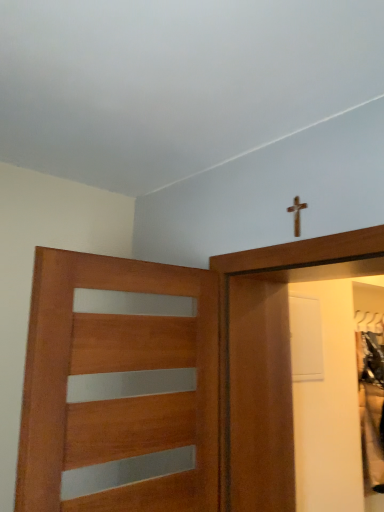
Question: From the image's perspective, would you say wooden cross at upper center is shown under wooden door with frosted glass panels at left?

Choices:
 (A) yes
 (B) no

Answer: (B)

Question: Can you confirm if wooden cross at upper center is positioned to the left of wooden door with frosted glass panels at left?

Choices:
 (A) no
 (B) yes

Answer: (A)

Question: Does wooden cross at upper center have a larger size compared to wooden door with frosted glass panels at left?

Choices:
 (A) yes
 (B) no

Answer: (B)

Question: Is wooden cross at upper center positioned in front of wooden door with frosted glass panels at left?

Choices:
 (A) no
 (B) yes

Answer: (A)

Question: Is wooden cross at upper center smaller than wooden door with frosted glass panels at left?

Choices:
 (A) yes
 (B) no

Answer: (A)

Question: Is wooden cross at upper center beside wooden door with frosted glass panels at left?

Choices:
 (A) no
 (B) yes

Answer: (A)

Question: From a real-world perspective, is wooden door with frosted glass panels at left over wooden cross at upper center?

Choices:
 (A) yes
 (B) no

Answer: (B)

Question: Is the depth of wooden door with frosted glass panels at left greater than that of wooden cross at upper center?

Choices:
 (A) yes
 (B) no

Answer: (B)

Question: Would you say wooden door with frosted glass panels at left is outside wooden cross at upper center?

Choices:
 (A) no
 (B) yes

Answer: (B)

Question: From the image's perspective, is wooden door with frosted glass panels at left located beneath wooden cross at upper center?

Choices:
 (A) yes
 (B) no

Answer: (A)

Question: Is wooden door with frosted glass panels at left facing away from wooden cross at upper center?

Choices:
 (A) yes
 (B) no

Answer: (B)

Question: Considering the relative sizes of wooden door with frosted glass panels at left and wooden cross at upper center in the image provided, is wooden door with frosted glass panels at left wider than wooden cross at upper center?

Choices:
 (A) yes
 (B) no

Answer: (A)

Question: Relative to wooden cross at upper center, is wooden door with frosted glass panels at left in front or behind?

Choices:
 (A) behind
 (B) front

Answer: (B)